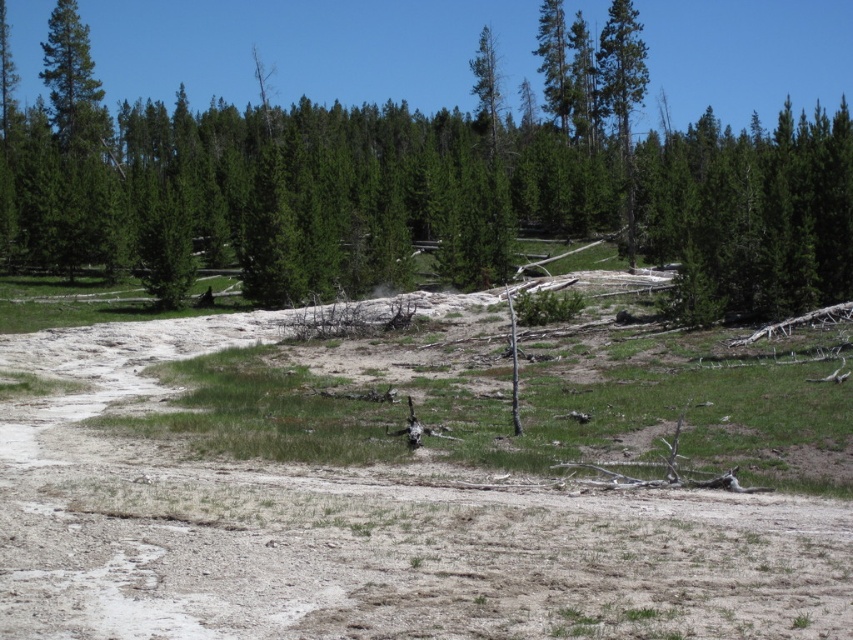
Question: Among these points, which one is farthest from the camera?

Choices:
 (A) (630, 157)
 (B) (289, 196)

Answer: (A)

Question: Does green matte tree at center appear on the right side of dull brown dirt field at center?

Choices:
 (A) yes
 (B) no

Answer: (B)

Question: Is green matte tree at center above dull brown dirt field at center?

Choices:
 (A) yes
 (B) no

Answer: (A)

Question: Which object is positioned farthest from the green matte tree at upper right?

Choices:
 (A) green matte tree at center
 (B) dull brown dirt field at center

Answer: (B)

Question: From the image, what is the correct spatial relationship of green matte tree at center in relation to green matte tree at upper right?

Choices:
 (A) right
 (B) left

Answer: (B)

Question: Which point is closer to the camera?

Choices:
 (A) green matte tree at upper right
 (B) dull brown dirt field at center
 (C) green matte tree at center

Answer: (B)